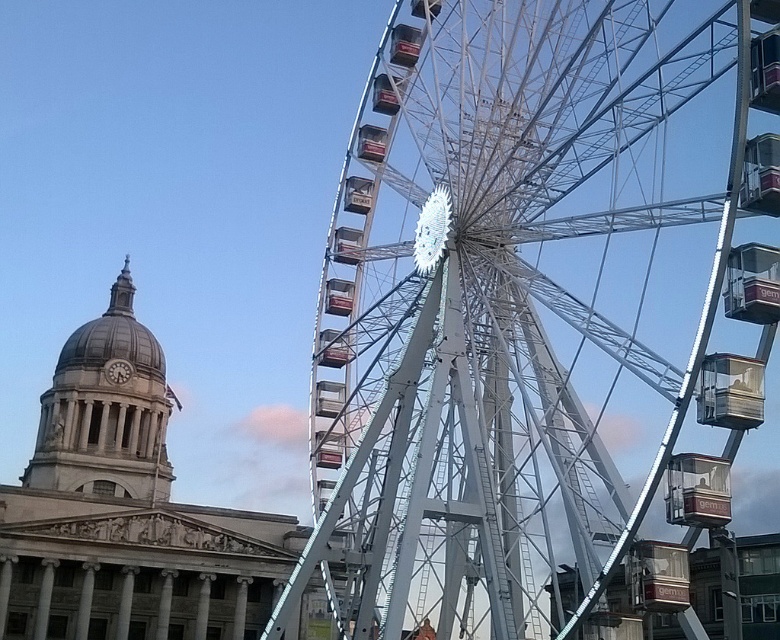
You are standing in front of the Ferris wheel and the classical building. There are two points marked in the image, one at coordinate point [507,387] and another at point [105,461]. Which of these two points is nearer to your current position?

Point [507,387] is closer to the camera than point [105,461], so the point at coordinate point [507,387] is nearer to your current position.

You are standing in the park and looking at the white metallic ferris wheel at center and the matte gray dome at upper left. Which object is positioned higher in the image?

The white metallic ferris wheel at center is positioned higher than the matte gray dome at upper left.